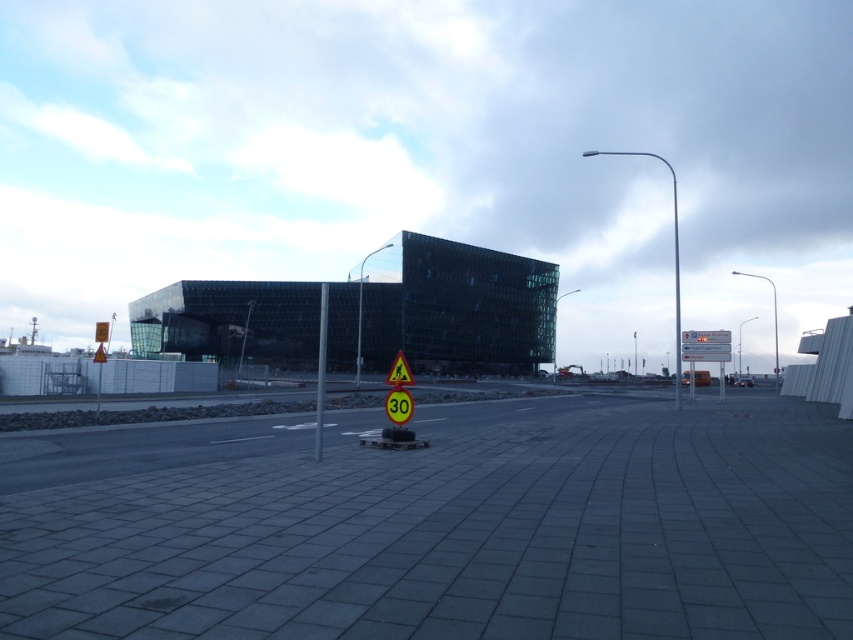
Question: Which point is closer to the camera?

Choices:
 (A) (22, 467)
 (B) (398, 385)
 (C) (318, 426)

Answer: (C)

Question: Estimate the real-world distances between objects in this image. Which object is farther from the metallic pole at center?

Choices:
 (A) gray concrete pavement at center
 (B) yellow reflective plastic speed limit sign at center
 (C) yellow reflective triangle at center

Answer: (B)

Question: Does metallic pole at center appear on the left side of yellow reflective triangle at center?

Choices:
 (A) yes
 (B) no

Answer: (A)

Question: Estimate the real-world distances between objects in this image. Which object is farther from the yellow reflective plastic speed limit sign at center?

Choices:
 (A) metallic pole at center
 (B) yellow reflective triangle at center
 (C) gray concrete pavement at center

Answer: (A)

Question: In this image, where is gray concrete pavement at center located relative to metallic pole at center?

Choices:
 (A) below
 (B) above

Answer: (A)

Question: Is gray concrete pavement at center closer to camera compared to yellow reflective triangle at center?

Choices:
 (A) yes
 (B) no

Answer: (A)